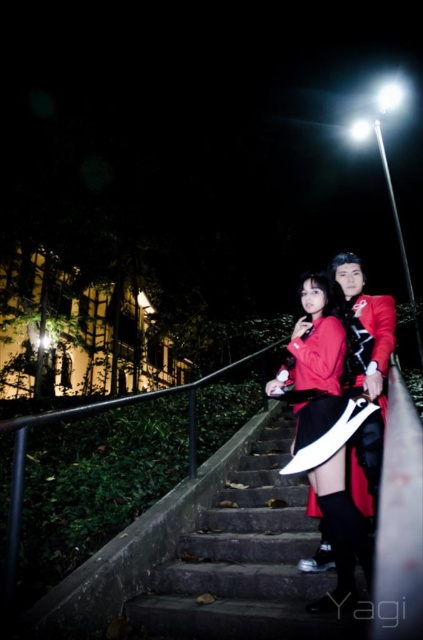
Consider the image. Can you confirm if smooth concrete stairs at center is taller than velvet red dress at center?

In fact, smooth concrete stairs at center may be shorter than velvet red dress at center.

The image size is (423, 640). What do you see at coordinates (246, 561) in the screenshot?
I see `smooth concrete stairs at center` at bounding box center [246, 561].

This screenshot has width=423, height=640. Find the location of `smooth concrete stairs at center`. smooth concrete stairs at center is located at coordinates (246, 561).

Does matte red jacket at center have a greater width compared to velvet red dress at center?

Correct, the width of matte red jacket at center exceeds that of velvet red dress at center.

Does matte red jacket at center have a greater height compared to velvet red dress at center?

Yes, matte red jacket at center is taller than velvet red dress at center.

Image resolution: width=423 pixels, height=640 pixels. Describe the element at coordinates (360, 369) in the screenshot. I see `matte red jacket at center` at that location.

Locate an element on the screen. The height and width of the screenshot is (640, 423). matte red jacket at center is located at coordinates (360, 369).

Between smooth concrete stairs at center and matte red jacket at center, which one is positioned lower?

smooth concrete stairs at center is lower down.

Who is more distant from viewer, (283, 426) or (359, 298)?

The point (283, 426) is more distant.

What do you see at coordinates (246, 561) in the screenshot? I see `smooth concrete stairs at center` at bounding box center [246, 561].

Identify the location of smooth concrete stairs at center. The height and width of the screenshot is (640, 423). (246, 561).